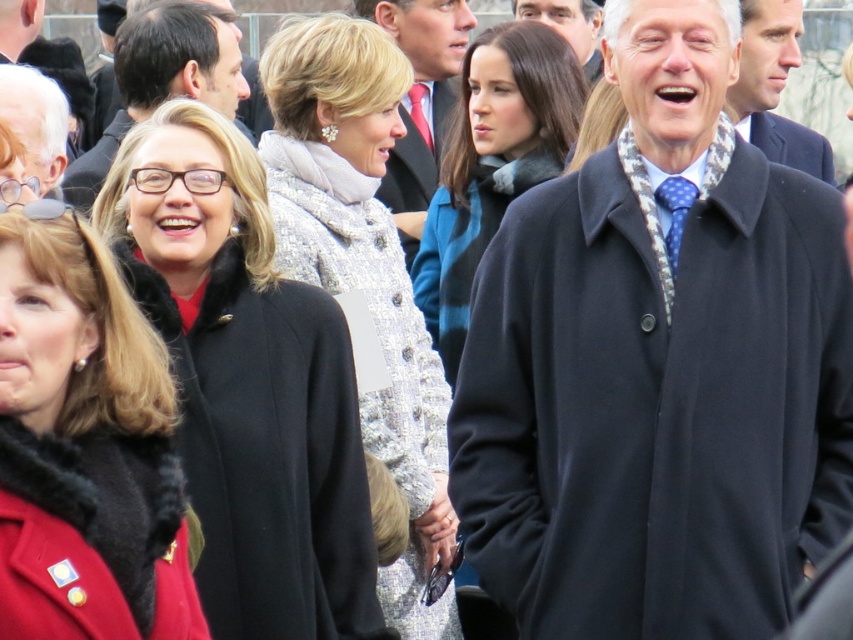
Can you confirm if teal wool coat at center is thinner than smooth blue tie at center?

In fact, teal wool coat at center might be wider than smooth blue tie at center.

Who is more distant from viewer, (560, 84) or (561, 35)?

The point (561, 35) is behind.

Is point (531, 83) closer to viewer compared to point (585, 22)?

Yes, point (531, 83) is closer to viewer.

This screenshot has height=640, width=853. What are the coordinates of `teal wool coat at center` in the screenshot? It's located at (492, 163).

The width and height of the screenshot is (853, 640). Describe the element at coordinates (36, 122) in the screenshot. I see `matte black coat at left` at that location.

Between matte black coat at left and polka dot silk tie at center, which one has less height?

matte black coat at left

Which is in front, point (16, 74) or point (421, 132)?

Point (16, 74) is in front.

Locate an element on the screen. matte black coat at left is located at coordinates (36, 122).

Does point (474, 152) come closer to viewer compared to point (9, 19)?

Yes, point (474, 152) is closer to viewer.

Consider the image. Can you confirm if teal wool coat at center is bigger than matte black coat at center?

Correct, teal wool coat at center is larger in size than matte black coat at center.

I want to click on teal wool coat at center, so click(492, 163).